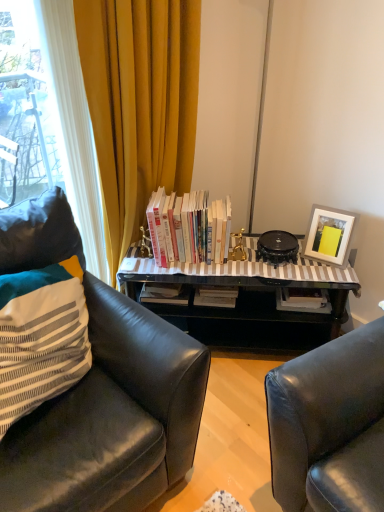
The width and height of the screenshot is (384, 512). What do you see at coordinates (41, 337) in the screenshot?
I see `striped fabric pillow at left` at bounding box center [41, 337].

What do you see at coordinates (247, 302) in the screenshot? I see `black glass table at center` at bounding box center [247, 302].

Measure the distance between black glass table at center and camera.

black glass table at center and camera are 6.19 feet apart from each other.

What do you see at coordinates (188, 228) in the screenshot? Image resolution: width=384 pixels, height=512 pixels. I see `white paperbacks at center` at bounding box center [188, 228].

What do you see at coordinates (111, 417) in the screenshot? Image resolution: width=384 pixels, height=512 pixels. I see `black leather chair at left` at bounding box center [111, 417].

The height and width of the screenshot is (512, 384). What are the coordinates of `white matte picture frame at upper right` in the screenshot? It's located at (329, 234).

You are a GUI agent. You are given a task and a screenshot of the screen. Output one action in this format:
    pyautogui.click(x=<x>, y=<y>)
    Task: Click on the striped fabric pillow at left
    This screenshot has height=512, width=384.
    Given the screenshot: What is the action you would take?
    pyautogui.click(x=41, y=337)

Who is more distant, striped fabric pillow at left or black leather chair at left?

striped fabric pillow at left is behind.

The height and width of the screenshot is (512, 384). What are the coordinates of `chair on the right side of striped fabric pillow at left` in the screenshot? It's located at (111, 417).

Considering the sizes of striped fabric pillow at left and black leather chair at left in the image, is striped fabric pillow at left wider or thinner than black leather chair at left?

striped fabric pillow at left is thinner than black leather chair at left.

Is black leather chair at left with white matte picture frame at upper right?

No.

Can you tell me how much black leather chair at left and white matte picture frame at upper right differ in facing direction?

They differ by 72 degrees in their facing directions.

Locate an element on the screen. Image resolution: width=384 pixels, height=512 pixels. picture frame that is above the black leather chair at left (from a real-world perspective) is located at coordinates (329, 234).

Based on the photo, from a real-world perspective, is black leather chair at left positioned over white matte picture frame at upper right based on gravity?

No.

Is white paperbacks at center positioned far away from black leather chair at left?

No, white paperbacks at center is in close proximity to black leather chair at left.

From a real-world perspective, is white paperbacks at center above or below black leather chair at left?

In terms of real-world spatial position, white paperbacks at center is above black leather chair at left.

Could you tell me if white paperbacks at center is turned towards black leather chair at left?

Yes.

Measure the distance from white paperbacks at center to black leather chair at left.

63.44 centimeters.

Is white paperbacks at center far from striped fabric pillow at left?

No.

Can you confirm if white paperbacks at center is smaller than striped fabric pillow at left?

Yes, white paperbacks at center is smaller than striped fabric pillow at left.

Relative to striped fabric pillow at left, is white paperbacks at center in front or behind?

In the image, white paperbacks at center appears behind striped fabric pillow at left.

Is white paperbacks at center situated inside striped fabric pillow at left or outside?

The correct answer is: outside.

This screenshot has height=512, width=384. Find the location of `picture frame below the white paperbacks at center (from a real-world perspective)`. picture frame below the white paperbacks at center (from a real-world perspective) is located at coordinates (329, 234).

From the image's perspective, which is above, white matte picture frame at upper right or white paperbacks at center?

white paperbacks at center is shown above in the image.

Is white matte picture frame at upper right positioned with its back to white paperbacks at center?

No, white matte picture frame at upper right's orientation is not away from white paperbacks at center.

Between white matte picture frame at upper right and striped fabric pillow at left, which one appears on the left side from the viewer's perspective?

Positioned to the left is striped fabric pillow at left.

Is white matte picture frame at upper right not near striped fabric pillow at left?

white matte picture frame at upper right is far away from striped fabric pillow at left.

Is striped fabric pillow at left a part of white matte picture frame at upper right?

No, white matte picture frame at upper right does not contain striped fabric pillow at left.

Is white matte picture frame at upper right taller or shorter than striped fabric pillow at left?

Considering their sizes, white matte picture frame at upper right has less height than striped fabric pillow at left.

Which is in front, striped fabric pillow at left or white paperbacks at center?

striped fabric pillow at left is in front.

From the image's perspective, between striped fabric pillow at left and white paperbacks at center, which one is located above?

white paperbacks at center.

How much distance is there between striped fabric pillow at left and white paperbacks at center?

The distance of striped fabric pillow at left from white paperbacks at center is 25.80 inches.

The width and height of the screenshot is (384, 512). I want to click on book that is under the striped fabric pillow at left (from a real-world perspective), so click(x=188, y=228).

The image size is (384, 512). I want to click on pillow that is on the left side of black leather chair at left, so click(x=41, y=337).

Locate an element on the screen. The image size is (384, 512). picture frame behind the black leather chair at left is located at coordinates (329, 234).

Which object lies nearer to the anchor point black leather chair at left, white matte picture frame at upper right or black glass table at center?

The object closer to black leather chair at left is black glass table at center.

Based on the photo, looking at the image, which one is located further to striped fabric pillow at left, black glass table at center or white matte picture frame at upper right?

white matte picture frame at upper right is further to striped fabric pillow at left.

When comparing their distances from black leather chair at left, does striped fabric pillow at left or white matte picture frame at upper right seem closer?

Among the two, striped fabric pillow at left is located nearer to black leather chair at left.

Looking at the image, which one is located closer to striped fabric pillow at left, white paperbacks at center or white matte picture frame at upper right?

The object closer to striped fabric pillow at left is white paperbacks at center.

From the image, which object appears to be nearer to striped fabric pillow at left, black glass table at center or black leather chair at left?

black leather chair at left lies closer to striped fabric pillow at left than the other object.

Estimate the real-world distances between objects in this image. Which object is further from black glass table at center, striped fabric pillow at left or black leather chair at left?

striped fabric pillow at left lies further to black glass table at center than the other object.

Based on their spatial positions, is white matte picture frame at upper right or black leather chair at left closer to black glass table at center?

white matte picture frame at upper right is positioned closer to the anchor black glass table at center.

When comparing their distances from black leather chair at left, does white matte picture frame at upper right or striped fabric pillow at left seem closer?

striped fabric pillow at left.

This screenshot has width=384, height=512. Identify the location of pillow between black leather chair at left and black glass table at center in the front-back direction. (41, 337).

Where is `table between striped fabric pillow at left and white matte picture frame at upper right in the horizontal direction`? The height and width of the screenshot is (512, 384). table between striped fabric pillow at left and white matte picture frame at upper right in the horizontal direction is located at coordinates (247, 302).

Locate an element on the screen. Image resolution: width=384 pixels, height=512 pixels. chair located between striped fabric pillow at left and white matte picture frame at upper right in the left-right direction is located at coordinates (111, 417).

You are a GUI agent. You are given a task and a screenshot of the screen. Output one action in this format:
    pyautogui.click(x=<x>, y=<y>)
    Task: Click on the table between black leather chair at left and white matte picture frame at upper right from front to back
    This screenshot has width=384, height=512.
    Given the screenshot: What is the action you would take?
    pyautogui.click(x=247, y=302)